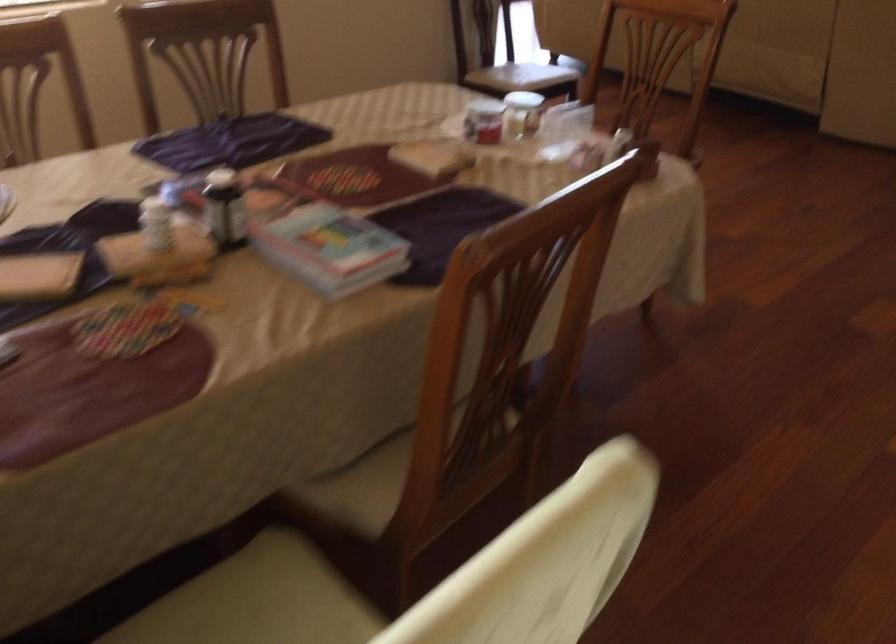
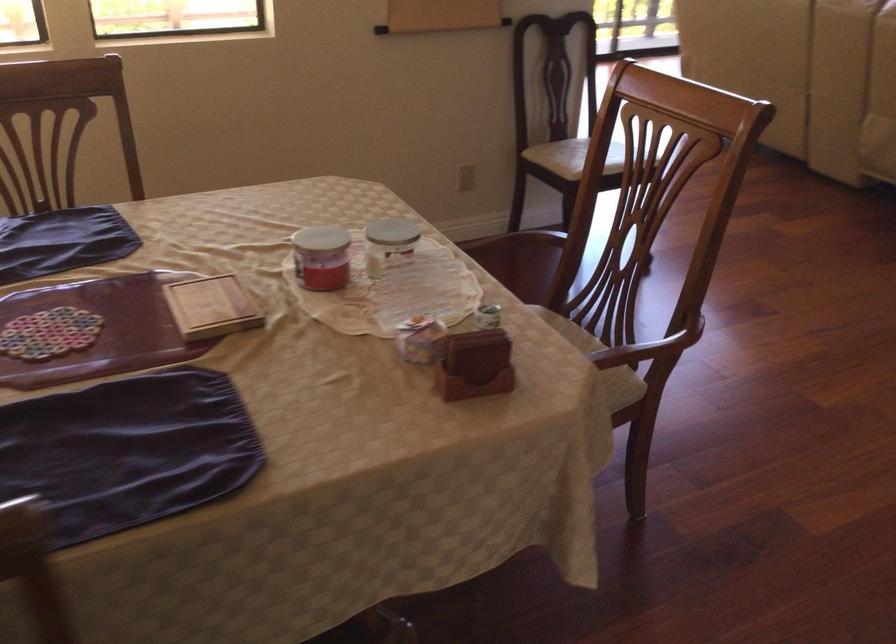
The point at (483, 120) is marked in the first image. Where is the corresponding point in the second image?

(321, 257)